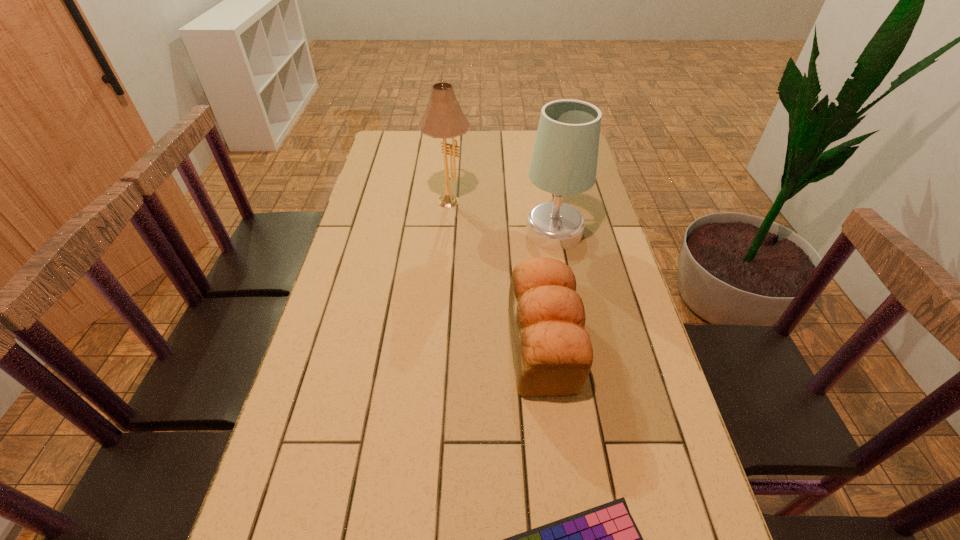
Locate an element on the screen. Image resolution: width=960 pixels, height=540 pixels. the left lampshade is located at coordinates 443,118.

Locate an element on the screen. Image resolution: width=960 pixels, height=540 pixels. the farthest object is located at coordinates (443, 118).

Find the location of `the second farthest object`. the second farthest object is located at coordinates (564, 162).

Where is `the right lampshade`? The width and height of the screenshot is (960, 540). the right lampshade is located at coordinates (564, 162).

You are a GUI agent. You are given a task and a screenshot of the screen. Output one action in this format:
    pyautogui.click(x=<x>, y=<y>)
    Task: Click on the bread
    
    Given the screenshot: What is the action you would take?
    pyautogui.click(x=552, y=353)

This screenshot has width=960, height=540. I want to click on the third farthest object, so click(x=552, y=353).

Where is `vacant space situated on the back of the farther lampshade`? vacant space situated on the back of the farther lampshade is located at coordinates (454, 138).

Where is `free region located on the base of the right lampshade`? The width and height of the screenshot is (960, 540). free region located on the base of the right lampshade is located at coordinates (442, 231).

The width and height of the screenshot is (960, 540). Find the location of `vacant space located on the base of the right lampshade`. vacant space located on the base of the right lampshade is located at coordinates (467, 231).

Where is `blank space located on the base of the right lampshade`? This screenshot has width=960, height=540. blank space located on the base of the right lampshade is located at coordinates (426, 231).